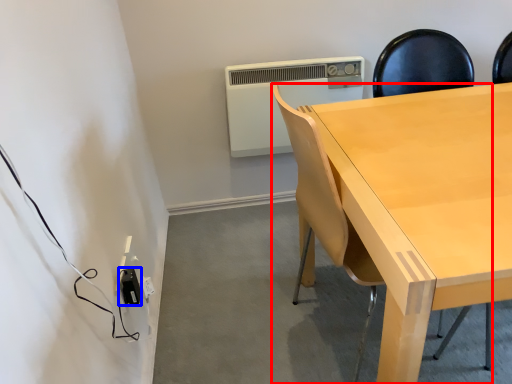
Question: Among these objects, which one is nearest to the camera, chair (highlighted by a red box) or electric outlet (highlighted by a blue box)?

Choices:
 (A) chair
 (B) electric outlet

Answer: (A)